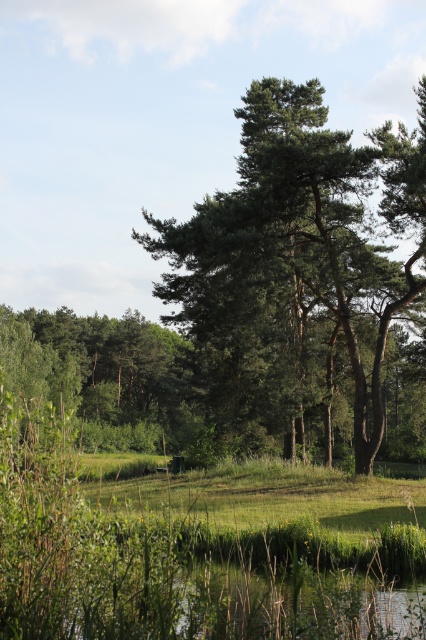
You are standing in the grassy area of the scene. You want to walk from the green leafy tree at left to the green leafy tree at center. Is the path between them wide enough for you to walk through comfortably?

The green leafy tree at center is narrower than the green leafy tree at left, so the space between them should be sufficient for comfortable passage.

You are standing in the grassy area of the scene and want to walk towards the green leafy tree at center. Which direction should you move relative to the green leafy tree at left?

You should move to the right relative to the green leafy tree at left because the green leafy tree at center is positioned to the right of it.

You are standing in the serene landscape and want to place a small decorative stone. You have two options for placement based on the coordinates provided. Which point, point (215, 273) or point (86, 339), is closer to you where you are standing?

Point (215, 273) is closer to the viewer than point (86, 339), so you should place the stone there if you want it nearer to your current position.